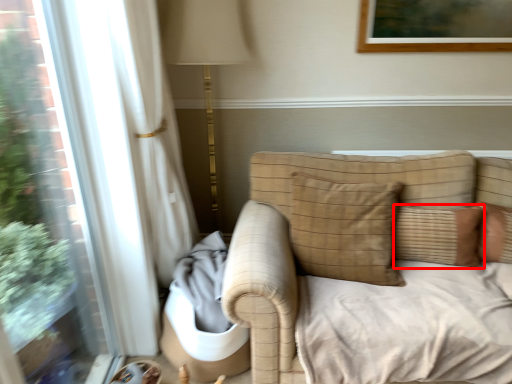
Question: From the image, what is the correct spatial relationship of pillow (annotated by the red box) in relation to pillow?

Choices:
 (A) right
 (B) left

Answer: (A)